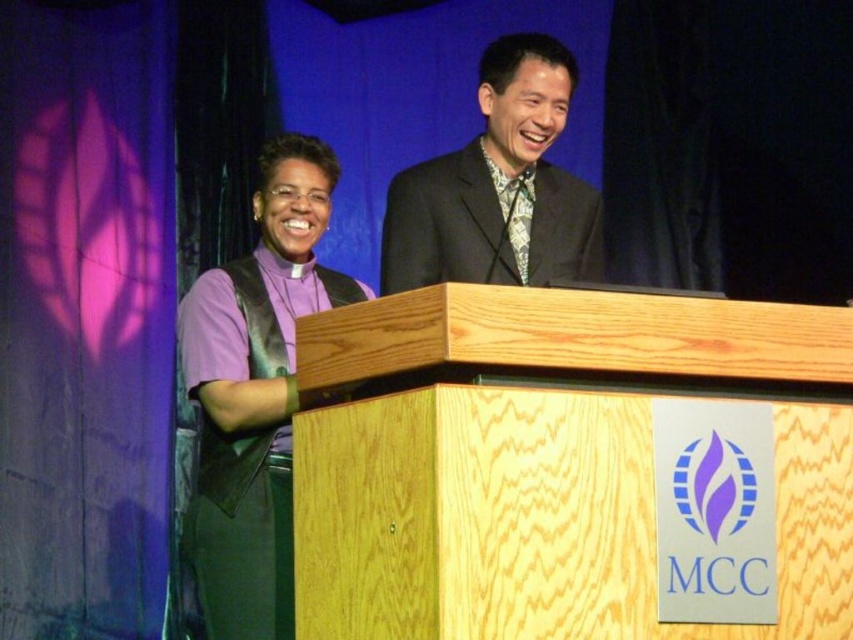
From the picture: Can you confirm if dark gray suit at center is bigger than green patterned tie at center?

Correct, dark gray suit at center is larger in size than green patterned tie at center.

Which is behind, point (450, 266) or point (518, 189)?

The point (518, 189) is behind.

Identify the location of dark gray suit at center. The width and height of the screenshot is (853, 640). (498, 186).

How far apart are purple matte vest at left and dark gray suit at center?

purple matte vest at left and dark gray suit at center are 30.49 inches apart.

Does purple matte vest at left have a greater width compared to dark gray suit at center?

In fact, purple matte vest at left might be narrower than dark gray suit at center.

Is point (230, 352) more distant than point (527, 84)?

No.

Identify the location of purple matte vest at left. (254, 392).

Can you confirm if purple matte vest at left is thinner than green patterned tie at center?

No.

Which is above, purple matte vest at left or green patterned tie at center?

Positioned higher is green patterned tie at center.

This screenshot has width=853, height=640. I want to click on purple matte vest at left, so click(254, 392).

At what (x,y) coordinates should I click in order to perform the action: click on purple matte vest at left. Please return your answer as a coordinate pair (x, y). Image resolution: width=853 pixels, height=640 pixels. Looking at the image, I should click on (254, 392).